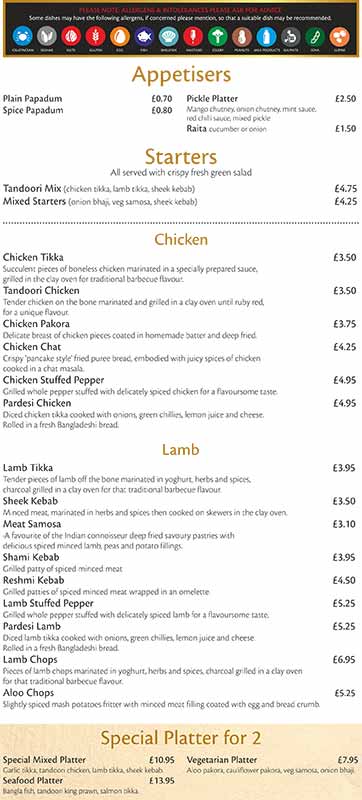
You are a GUI agent. You are given a task and a screenshot of the screen. Output one action in this format:
    pyautogui.click(x=<x>, y=<y>)
    Task: Click on the food menu section headers
    The width and height of the screenshot is (362, 800).
    Given the screenshot: What is the action you would take?
    pyautogui.click(x=170, y=78), pyautogui.click(x=175, y=156), pyautogui.click(x=181, y=242), pyautogui.click(x=184, y=450), pyautogui.click(x=179, y=736)